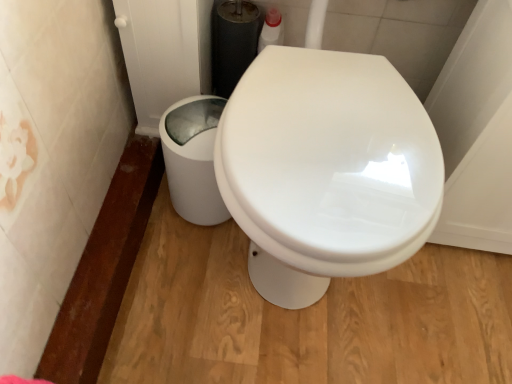
Question: Can you confirm if white glossy trash can at lower left is wider than clear glass screen door at upper left?

Choices:
 (A) yes
 (B) no

Answer: (B)

Question: Can you confirm if white glossy trash can at lower left is thinner than clear glass screen door at upper left?

Choices:
 (A) no
 (B) yes

Answer: (B)

Question: Is white glossy trash can at lower left closer to camera compared to clear glass screen door at upper left?

Choices:
 (A) yes
 (B) no

Answer: (B)

Question: From a real-world perspective, is white glossy trash can at lower left on top of clear glass screen door at upper left?

Choices:
 (A) no
 (B) yes

Answer: (A)

Question: Can you confirm if white glossy trash can at lower left is taller than clear glass screen door at upper left?

Choices:
 (A) yes
 (B) no

Answer: (B)

Question: From the image's perspective, is white glossy trash can at lower left below clear glass screen door at upper left?

Choices:
 (A) no
 (B) yes

Answer: (B)

Question: Is clear glass screen door at upper left taller than white glossy trash can at lower left?

Choices:
 (A) yes
 (B) no

Answer: (A)

Question: Could you tell me if clear glass screen door at upper left is turned towards white glossy trash can at lower left?

Choices:
 (A) yes
 (B) no

Answer: (B)

Question: Is the depth of clear glass screen door at upper left less than that of white glossy trash can at lower left?

Choices:
 (A) no
 (B) yes

Answer: (B)

Question: From a real-world perspective, is clear glass screen door at upper left located higher than white glossy trash can at lower left?

Choices:
 (A) yes
 (B) no

Answer: (A)

Question: Does clear glass screen door at upper left appear on the left side of white glossy trash can at lower left?

Choices:
 (A) yes
 (B) no

Answer: (A)

Question: Is clear glass screen door at upper left positioned behind white glossy trash can at lower left?

Choices:
 (A) yes
 (B) no

Answer: (B)

Question: Is clear glass screen door at upper left inside or outside of white glossy trash can at lower left?

Choices:
 (A) outside
 (B) inside

Answer: (A)